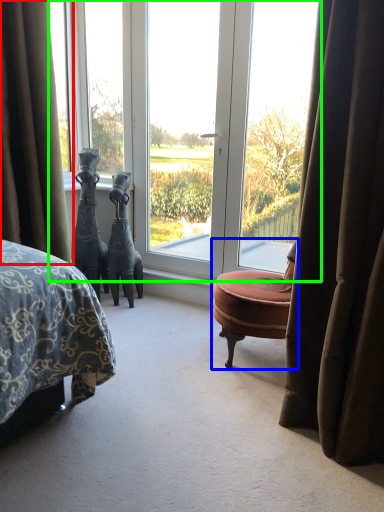
Question: Estimate the real-world distances between objects in this image. Which object is closer to curtain (highlighted by a red box), chair (highlighted by a blue box) or window (highlighted by a green box)?

Choices:
 (A) chair
 (B) window

Answer: (B)